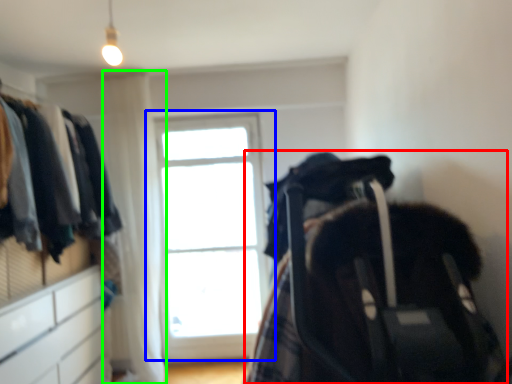
Question: Which object is the closest to the baby carriage (highlighted by a red box)? Choose among these: window (highlighted by a blue box) or curtain (highlighted by a green box).

Choices:
 (A) window
 (B) curtain

Answer: (B)